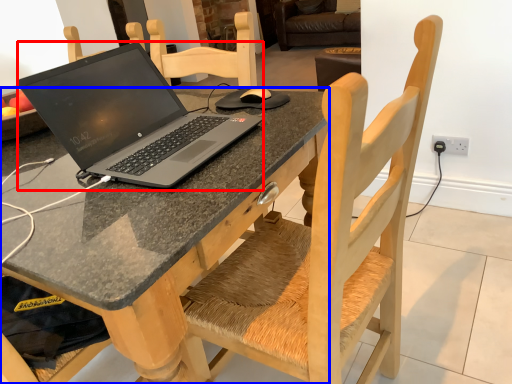
Question: Which object is further to the camera taking this photo, laptop (highlighted by a red box) or desk (highlighted by a blue box)?

Choices:
 (A) laptop
 (B) desk

Answer: (A)